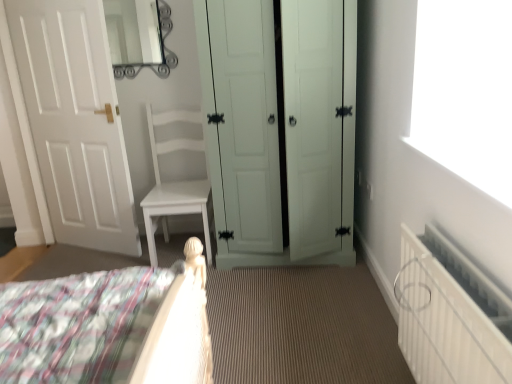
Question: Are white matte door at left, which is counted as the 1th door, starting from the left, and metallic silver mirror at upper center located far from each other?

Choices:
 (A) yes
 (B) no

Answer: (B)

Question: Is white matte door at left, which is counted as the 1th door, starting from the left, closer to camera compared to metallic silver mirror at upper center?

Choices:
 (A) no
 (B) yes

Answer: (B)

Question: Is white matte door at left, acting as the 2th door starting from the right, to the left of metallic silver mirror at upper center from the viewer's perspective?

Choices:
 (A) no
 (B) yes

Answer: (B)

Question: Can you confirm if white matte door at left, acting as the 2th door starting from the right, is positioned to the right of metallic silver mirror at upper center?

Choices:
 (A) yes
 (B) no

Answer: (B)

Question: From the image's perspective, is white matte door at left, acting as the 2th door starting from the right, on metallic silver mirror at upper center?

Choices:
 (A) yes
 (B) no

Answer: (B)

Question: From a real-world perspective, does white matte door at left, which is counted as the 1th door, starting from the left, sit lower than metallic silver mirror at upper center?

Choices:
 (A) no
 (B) yes

Answer: (B)

Question: Does white matte door at left, acting as the 2th door starting from the right, have a larger size compared to light green wood wardrobe at center, which is the 2th door in left-to-right order?

Choices:
 (A) no
 (B) yes

Answer: (A)

Question: Is light green wood wardrobe at center, the first door in the right-to-left sequence, inside white matte door at left, acting as the 2th door starting from the right?

Choices:
 (A) no
 (B) yes

Answer: (A)

Question: Does white matte door at left, which is counted as the 1th door, starting from the left, have a lesser height compared to light green wood wardrobe at center, which is the 2th door in left-to-right order?

Choices:
 (A) yes
 (B) no

Answer: (B)

Question: From the image's perspective, is white matte door at left, which is counted as the 1th door, starting from the left, located above light green wood wardrobe at center, the first door in the right-to-left sequence?

Choices:
 (A) no
 (B) yes

Answer: (B)

Question: Is white matte door at left, which is counted as the 1th door, starting from the left, closer to camera compared to light green wood wardrobe at center, which is the 2th door in left-to-right order?

Choices:
 (A) no
 (B) yes

Answer: (A)

Question: Can you confirm if white matte door at left, acting as the 2th door starting from the right, is smaller than light green wood wardrobe at center, which is the 2th door in left-to-right order?

Choices:
 (A) yes
 (B) no

Answer: (A)

Question: Is white textured radiator at lower right positioned in front of metallic silver mirror at upper center?

Choices:
 (A) no
 (B) yes

Answer: (B)